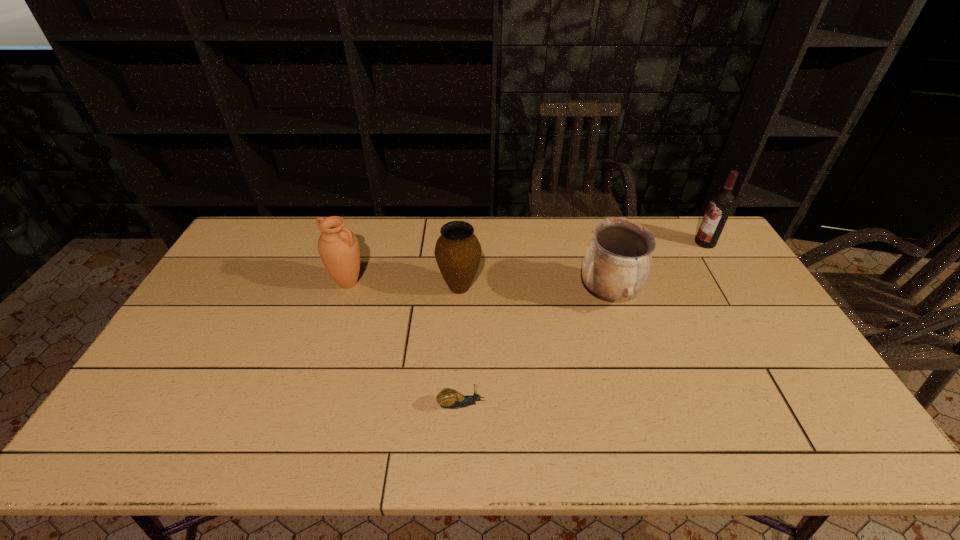
Find the location of a particular element. The height and width of the screenshot is (540, 960). the third closest object relative to the rightmost object is located at coordinates (447, 398).

Choose which object is the nearest neighbor to the wine bottle. Please provide its 2D coordinates. Your answer should be formatted as a tuple, i.e. [(x, y)], where the tuple contains the x and y coordinates of a point satisfying the conditions above.

[(617, 262)]

Point out which urn is positioned as the second nearest to the leftmost object. Please provide its 2D coordinates. Your answer should be formatted as a tuple, i.e. [(x, y)], where the tuple contains the x and y coordinates of a point satisfying the conditions above.

[(617, 262)]

Identify which urn is the nearest to the second urn from right to left. Please provide its 2D coordinates. Your answer should be formatted as a tuple, i.e. [(x, y)], where the tuple contains the x and y coordinates of a point satisfying the conditions above.

[(338, 246)]